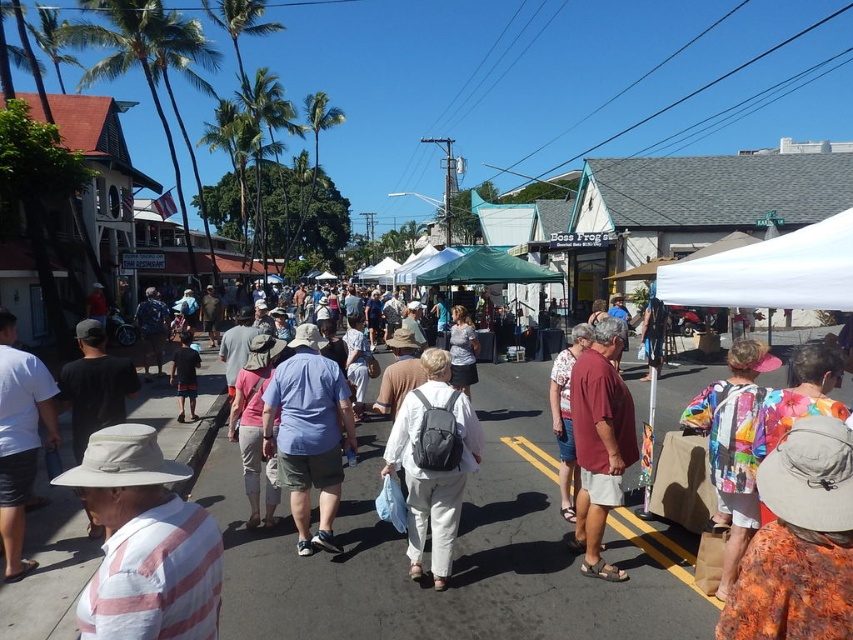
Question: Based on their relative distances, which object is farther from the blue cotton shirt at center?

Choices:
 (A) matte gray backpack at center
 (B) dark blue shorts at center
 (C) white fabric canopy at upper right
 (D) matte red shirt at center

Answer: (B)

Question: Which of the following is the farthest from the observer?

Choices:
 (A) (177, 381)
 (B) (584, 552)

Answer: (A)

Question: Can you confirm if white fabric canopy at upper right is positioned below dark blue shorts at center?

Choices:
 (A) yes
 (B) no

Answer: (B)

Question: Considering the real-world distances, which object is farthest from the matte gray backpack at center?

Choices:
 (A) blue cotton shirt at center
 (B) white fabric canopy at upper right
 (C) white striped shirt at left

Answer: (C)

Question: Is maroon fabric shirt at center positioned at the back of dark blue shorts at center?

Choices:
 (A) no
 (B) yes

Answer: (A)

Question: Can you confirm if blue cotton shirt at center is positioned below white fabric canopy at upper right?

Choices:
 (A) yes
 (B) no

Answer: (A)